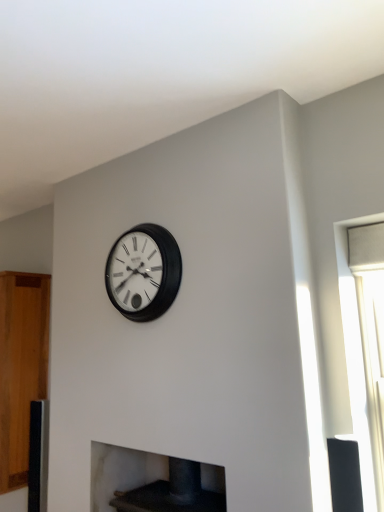
Question: Does dark gray stone fireplace at lower center have a smaller size compared to wooden cabinet at left?

Choices:
 (A) yes
 (B) no

Answer: (A)

Question: From a real-world perspective, is dark gray stone fireplace at lower center located beneath wooden cabinet at left?

Choices:
 (A) no
 (B) yes

Answer: (B)

Question: From the image's perspective, is dark gray stone fireplace at lower center beneath wooden cabinet at left?

Choices:
 (A) yes
 (B) no

Answer: (A)

Question: Can you confirm if dark gray stone fireplace at lower center is thinner than wooden cabinet at left?

Choices:
 (A) yes
 (B) no

Answer: (A)

Question: Is dark gray stone fireplace at lower center beside wooden cabinet at left?

Choices:
 (A) yes
 (B) no

Answer: (B)

Question: Considering the positions of point (135, 470) and point (162, 256), is point (135, 470) closer or farther from the camera than point (162, 256)?

Choices:
 (A) farther
 (B) closer

Answer: (A)

Question: From a real-world perspective, is dark gray stone fireplace at lower center positioned above or below matte black clock at center?

Choices:
 (A) below
 (B) above

Answer: (A)

Question: Considering the positions of dark gray stone fireplace at lower center and matte black clock at center in the image, is dark gray stone fireplace at lower center taller or shorter than matte black clock at center?

Choices:
 (A) short
 (B) tall

Answer: (A)

Question: From the image's perspective, is dark gray stone fireplace at lower center above or below matte black clock at center?

Choices:
 (A) above
 (B) below

Answer: (B)

Question: In terms of height, does matte black clock at center look taller or shorter compared to dark gray stone fireplace at lower center?

Choices:
 (A) tall
 (B) short

Answer: (A)

Question: Is matte black clock at center wider or thinner than dark gray stone fireplace at lower center?

Choices:
 (A) wide
 (B) thin

Answer: (B)

Question: Is matte black clock at center inside the boundaries of dark gray stone fireplace at lower center, or outside?

Choices:
 (A) outside
 (B) inside

Answer: (A)

Question: Relative to dark gray stone fireplace at lower center, is matte black clock at center in front or behind?

Choices:
 (A) front
 (B) behind

Answer: (B)

Question: Is point (41, 352) closer or farther from the camera than point (114, 306)?

Choices:
 (A) closer
 (B) farther

Answer: (B)

Question: Based on their positions, is wooden cabinet at left located to the left or right of matte black clock at center?

Choices:
 (A) right
 (B) left

Answer: (B)